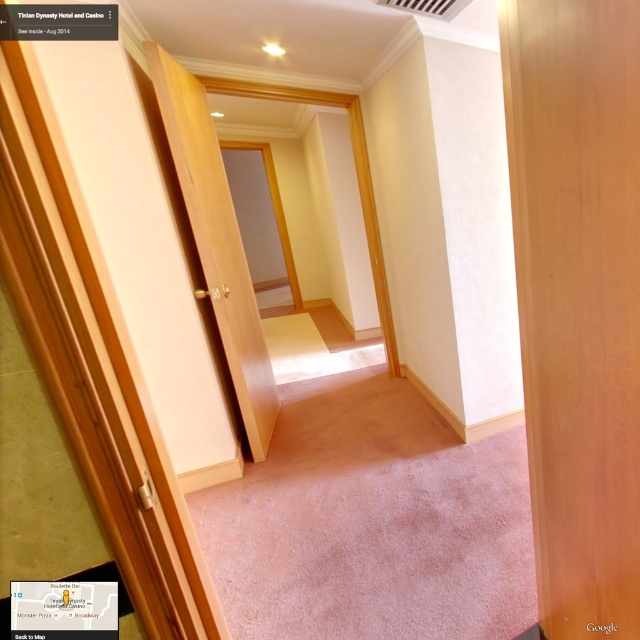
The height and width of the screenshot is (640, 640). Describe the element at coordinates (577, 300) in the screenshot. I see `light brown wood door at center` at that location.

Is light brown wood door at center bigger than wooden door at center?

Actually, light brown wood door at center might be smaller than wooden door at center.

Who is more forward, (566, 476) or (240, 260)?

Point (566, 476) is in front.

You are a GUI agent. You are given a task and a screenshot of the screen. Output one action in this format:
    pyautogui.click(x=<x>, y=<y>)
    Task: Click on the light brown wood door at center
    
    Given the screenshot: What is the action you would take?
    pyautogui.click(x=577, y=300)